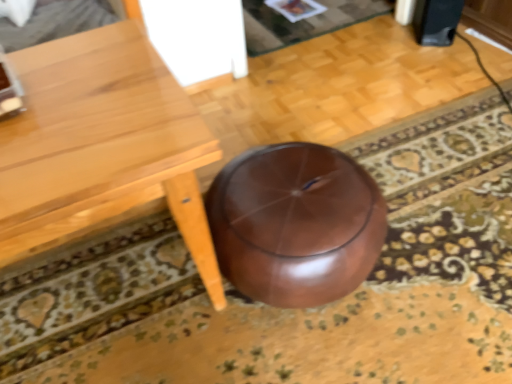
Question: From the image's perspective, is black matte speaker at upper right above light brown wooden table at lower right?

Choices:
 (A) no
 (B) yes

Answer: (B)

Question: From a real-world perspective, is black matte speaker at upper right located beneath light brown wooden table at lower right?

Choices:
 (A) yes
 (B) no

Answer: (A)

Question: Could you tell me if black matte speaker at upper right is facing light brown wooden table at lower right?

Choices:
 (A) yes
 (B) no

Answer: (B)

Question: Is black matte speaker at upper right directly adjacent to light brown wooden table at lower right?

Choices:
 (A) no
 (B) yes

Answer: (A)

Question: From a real-world perspective, is black matte speaker at upper right on top of light brown wooden table at lower right?

Choices:
 (A) yes
 (B) no

Answer: (B)

Question: Is black matte speaker at upper right looking in the opposite direction of light brown wooden table at lower right?

Choices:
 (A) no
 (B) yes

Answer: (A)

Question: Does light brown wooden table at lower right have a smaller size compared to black matte speaker at upper right?

Choices:
 (A) no
 (B) yes

Answer: (A)

Question: From the image's perspective, is light brown wooden table at lower right located beneath black matte speaker at upper right?

Choices:
 (A) yes
 (B) no

Answer: (A)

Question: Is the position of light brown wooden table at lower right more distant than that of black matte speaker at upper right?

Choices:
 (A) no
 (B) yes

Answer: (A)

Question: From the image's perspective, is light brown wooden table at lower right over black matte speaker at upper right?

Choices:
 (A) yes
 (B) no

Answer: (B)

Question: From a real-world perspective, is light brown wooden table at lower right on top of black matte speaker at upper right?

Choices:
 (A) yes
 (B) no

Answer: (A)

Question: Is light brown wooden table at lower right oriented away from black matte speaker at upper right?

Choices:
 (A) no
 (B) yes

Answer: (A)

Question: Is point tap(61, 213) closer or farther from the camera than point tap(421, 29)?

Choices:
 (A) closer
 (B) farther

Answer: (A)